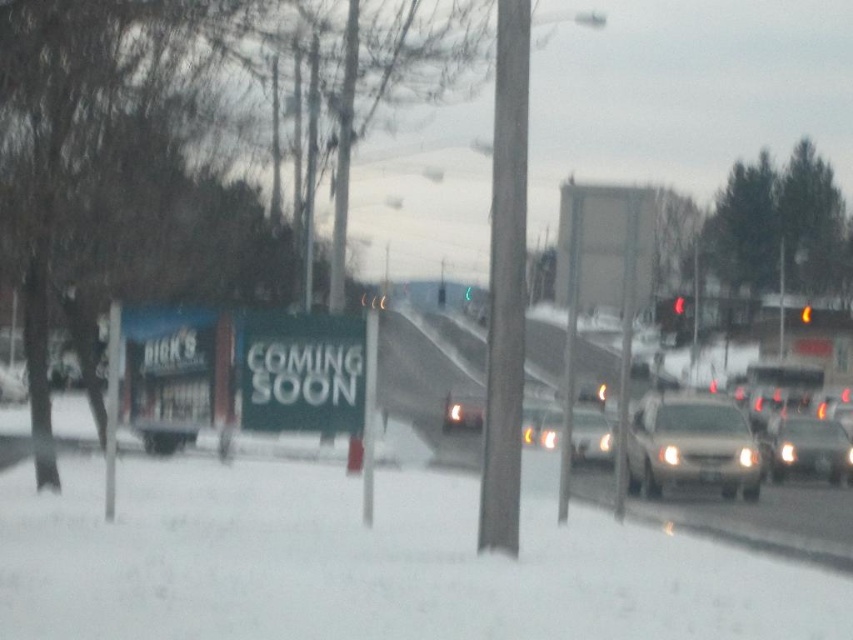
Question: Which point appears closest to the camera in this image?

Choices:
 (A) (674, 300)
 (B) (257, 364)
 (C) (543, 426)

Answer: (B)

Question: Can you confirm if matte silver sedan at right is positioned to the right of red glass traffic light at upper right?

Choices:
 (A) no
 (B) yes

Answer: (A)

Question: Which point is closer to the camera?

Choices:
 (A) metallic silver sedan at center
 (B) white plastic sign at center
 (C) matte silver sedan at right

Answer: (B)

Question: From the image, what is the correct spatial relationship of metallic silver sedan at center in relation to red glass traffic light at upper right?

Choices:
 (A) above
 (B) below

Answer: (B)

Question: Is white plastic sign at center wider than red glass traffic light at upper center?

Choices:
 (A) no
 (B) yes

Answer: (A)

Question: Which object is positioned closest to the white plastic sign at center?

Choices:
 (A) satin gold sedan at center
 (B) matte silver sedan at right
 (C) metallic silver sedan at center

Answer: (C)